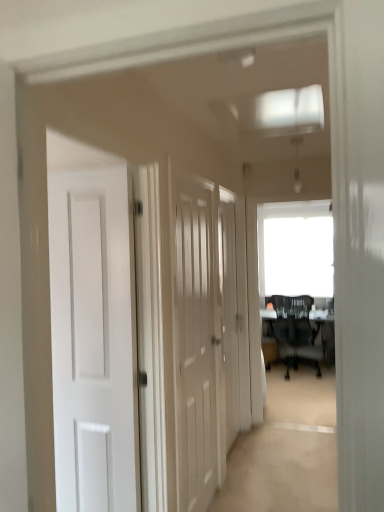
Question: From a real-world perspective, is black mesh chair at center under white wood door at center, the 1th door viewed from the left?

Choices:
 (A) yes
 (B) no

Answer: (A)

Question: Considering the relative sizes of black mesh chair at center and white wood door at center, marked as the 1th door in a front-to-back arrangement, in the image provided, is black mesh chair at center shorter than white wood door at center, marked as the 1th door in a front-to-back arrangement,?

Choices:
 (A) no
 (B) yes

Answer: (B)

Question: Is black mesh chair at center facing towards white wood door at center, marked as the 1th door in a front-to-back arrangement?

Choices:
 (A) yes
 (B) no

Answer: (B)

Question: Considering the relative positions of black mesh chair at center and white wood door at center, the 1th door viewed from the left, in the image provided, is black mesh chair at center to the left of white wood door at center, the 1th door viewed from the left, from the viewer's perspective?

Choices:
 (A) no
 (B) yes

Answer: (A)

Question: From a real-world perspective, is black mesh chair at center on top of white wood door at center, the 2th door from the back?

Choices:
 (A) no
 (B) yes

Answer: (A)

Question: Is white wood door at center, the 2th door from the back, in front of or behind black mesh chair at center in the image?

Choices:
 (A) behind
 (B) front

Answer: (B)

Question: Based on their sizes in the image, would you say white wood door at center, the 2th door from the back, is bigger or smaller than black mesh chair at center?

Choices:
 (A) small
 (B) big

Answer: (A)

Question: From a real-world perspective, is white wood door at center, which is counted as the 2th door, starting from the right, above or below black mesh chair at center?

Choices:
 (A) above
 (B) below

Answer: (A)

Question: Would you say white wood door at center, which is counted as the 2th door, starting from the right, is to the left or to the right of black mesh chair at center in the picture?

Choices:
 (A) left
 (B) right

Answer: (A)

Question: Looking at their shapes, would you say white wood door at center, which is the first door in right-to-left order, is wider or thinner than white wood door at center, the 1th door viewed from the left?

Choices:
 (A) thin
 (B) wide

Answer: (A)

Question: Is white wood door at center, marked as the 2th door in a front-to-back arrangement, in front of or behind white wood door at center, which is counted as the 2th door, starting from the right, in the image?

Choices:
 (A) front
 (B) behind

Answer: (B)

Question: Choose the correct answer: Is white wood door at center, the first door in the back-to-front sequence, inside white wood door at center, the 2th door from the back, or outside it?

Choices:
 (A) outside
 (B) inside

Answer: (A)

Question: From a real-world perspective, relative to white wood door at center, the 1th door viewed from the left, is white wood door at center, marked as the 2th door in a front-to-back arrangement, vertically above or below?

Choices:
 (A) above
 (B) below

Answer: (B)

Question: Is black mesh chair at center to the left or to the right of white wood door at center, the first door in the back-to-front sequence, in the image?

Choices:
 (A) left
 (B) right

Answer: (B)

Question: Is point click(314, 329) positioned closer to the camera than point click(230, 417)?

Choices:
 (A) farther
 (B) closer

Answer: (A)